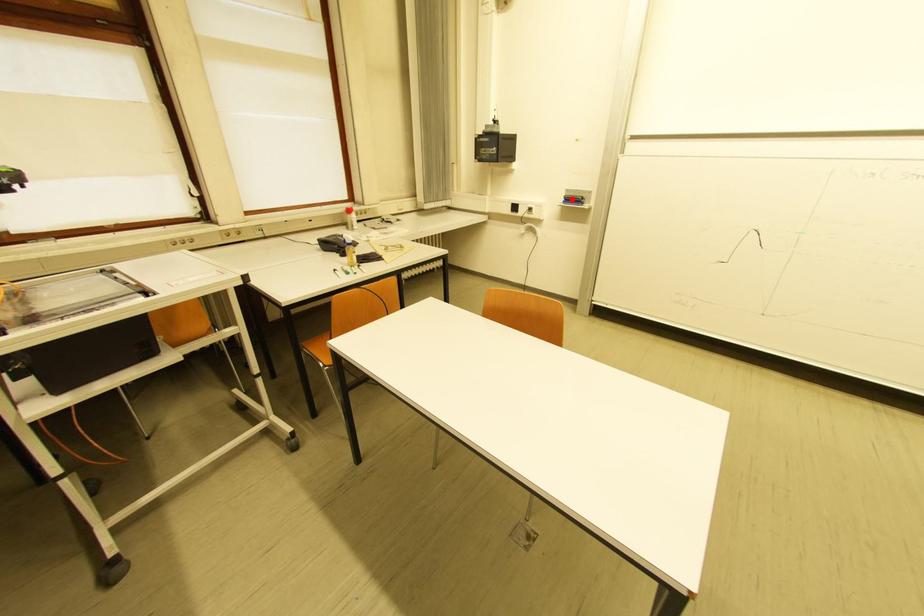
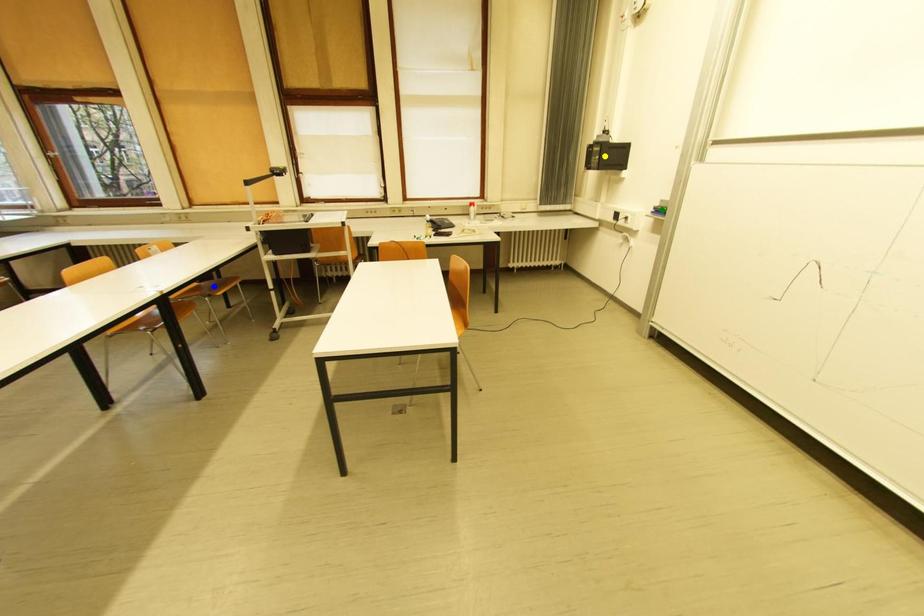
Question: I am providing you with two images of the same scene from different viewpoints. A red point is marked on the first image. You are given multiple points on the second image. In image 2, which mark is for the same physical point as the one in image 1?

Choices:
 (A) blue point
 (B) yellow point
 (C) green point

Answer: (C)